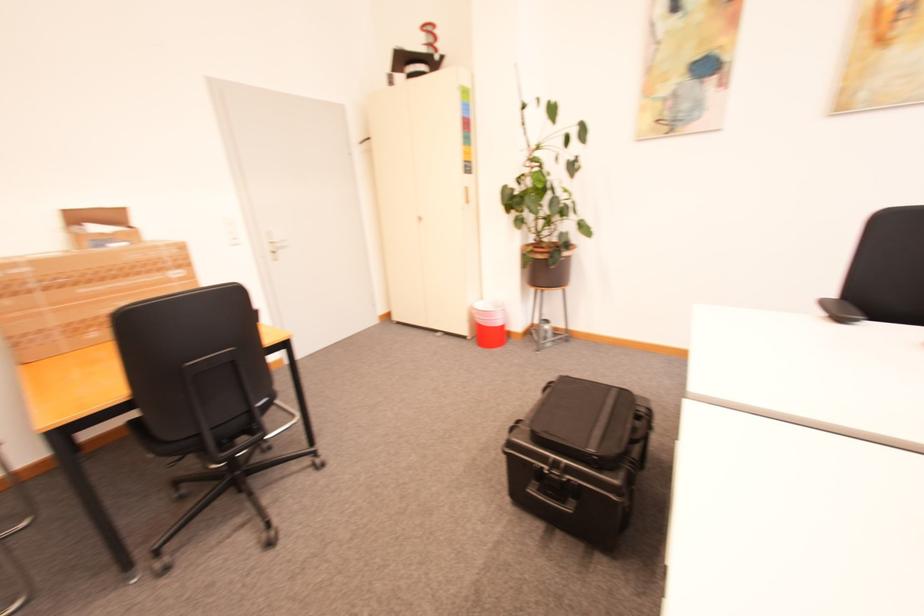
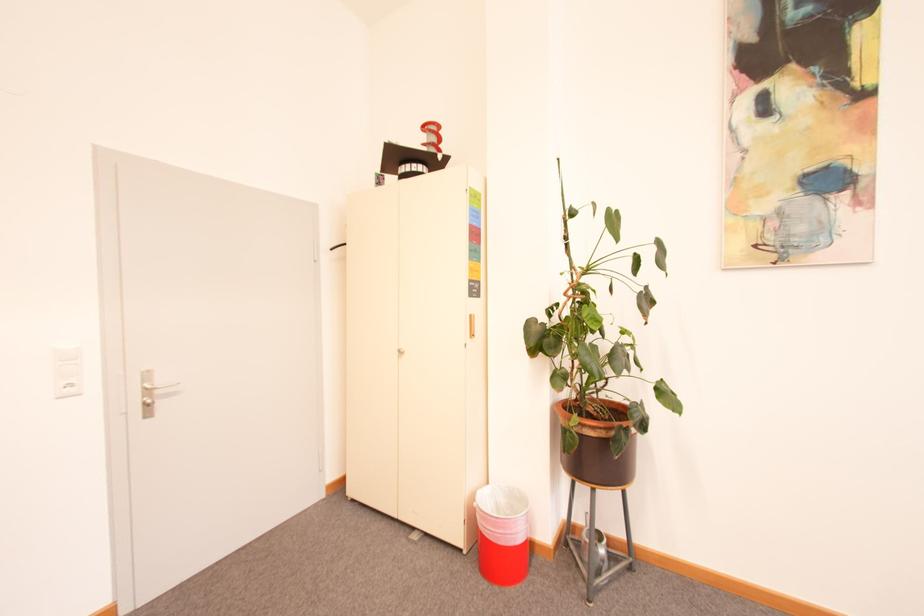
Question: Which direction would the cameraman need to move to produce the second image? Reply with the corresponding letter.

Choices:
 (A) Left
 (B) Right
 (C) Forward
 (D) Backward

Answer: (C)